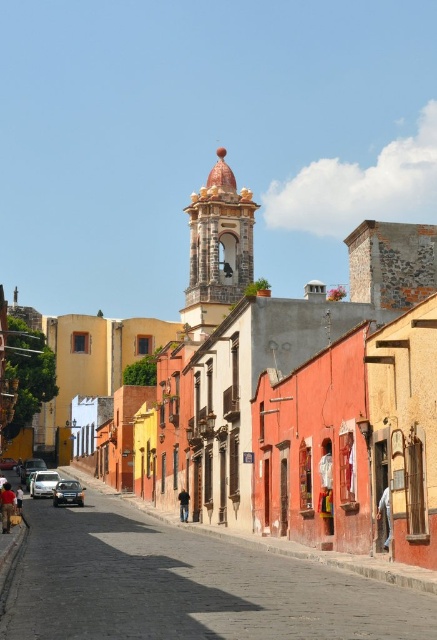
Can you confirm if smooth cobblestone street at center is bigger than dark brown leather jacket at lower left?

Indeed, smooth cobblestone street at center has a larger size compared to dark brown leather jacket at lower left.

Who is more distant from viewer, (121, 524) or (20, 499)?

The point (121, 524) is behind.

Locate an element on the screen. The height and width of the screenshot is (640, 437). smooth cobblestone street at center is located at coordinates (187, 586).

The height and width of the screenshot is (640, 437). I want to click on matte orange building at center, so click(297, 410).

At what (x,y) coordinates should I click in order to perform the action: click on matte orange building at center. Please return your answer as a coordinate pair (x, y). The height and width of the screenshot is (640, 437). Looking at the image, I should click on (297, 410).

Is gray fabric pants at lower right wider than shiny silver car at center?

No.

Which is below, gray fabric pants at lower right or shiny silver car at center?

shiny silver car at center

Is point (388, 493) positioned before point (10, 465)?

Yes.

Locate an element on the screen. The image size is (437, 640). gray fabric pants at lower right is located at coordinates [384, 515].